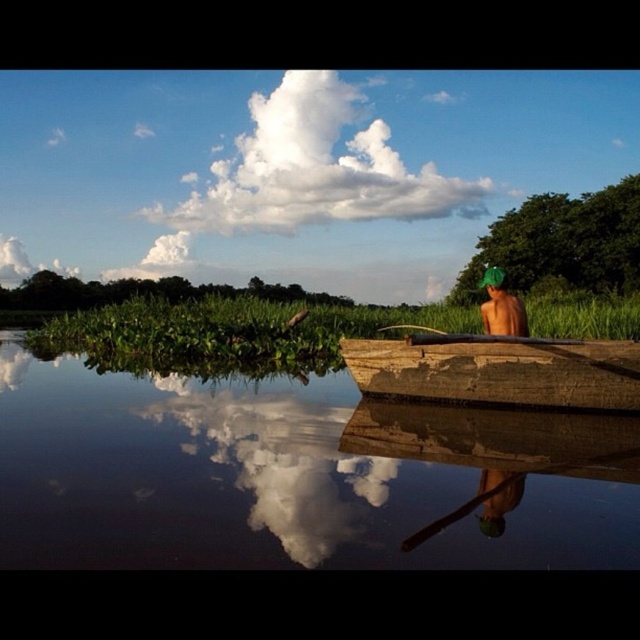
Is point (348, 92) positioned before point (497, 291)?

No, it is behind (497, 291).

Does white fluffy cloud at upper center have a greater width compared to green matte hat at upper right?

Yes, white fluffy cloud at upper center is wider than green matte hat at upper right.

This screenshot has height=640, width=640. In order to click on white fluffy cloud at upper center in this screenshot , I will do `click(308, 172)`.

Is rusty wood boat at right above green matte hat at upper right?

Actually, rusty wood boat at right is below green matte hat at upper right.

Is point (440, 353) farther from camera compared to point (486, 307)?

No, it is not.

The image size is (640, 640). I want to click on rusty wood boat at right, so click(499, 371).

Is smooth brown water at center bigger than green matte hat at upper right?

Indeed, smooth brown water at center has a larger size compared to green matte hat at upper right.

This screenshot has height=640, width=640. What do you see at coordinates (294, 476) in the screenshot?
I see `smooth brown water at center` at bounding box center [294, 476].

Who is more forward, (3, 360) or (524, 308)?

Point (524, 308) is more forward.

The image size is (640, 640). What are the coordinates of `smooth brown water at center` in the screenshot? It's located at click(294, 476).